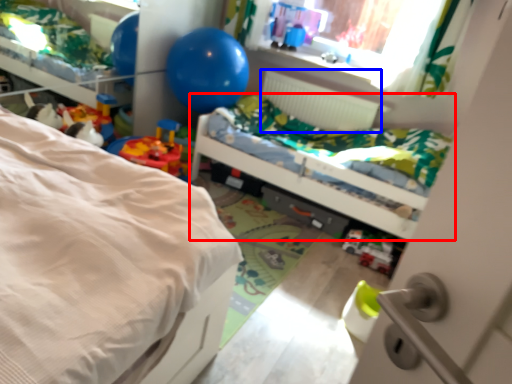
Question: Which object appears farthest to the camera in this image, bed (highlighted by a red box) or radiator (highlighted by a blue box)?

Choices:
 (A) bed
 (B) radiator

Answer: (B)